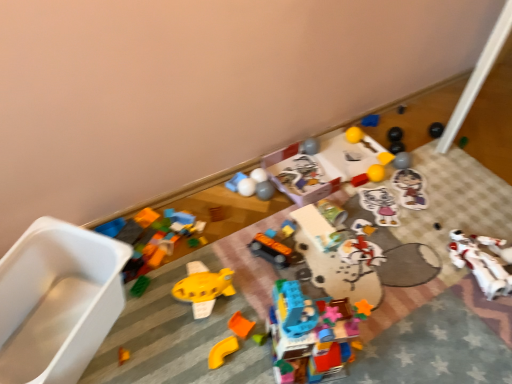
Where is `vacant area that lies between yellow rubber ball at upper center, the 3th toy in the right-to-left sequence, and orange matte plastic toy at lower center, the fifteenth toy viewed from the right`? vacant area that lies between yellow rubber ball at upper center, the 3th toy in the right-to-left sequence, and orange matte plastic toy at lower center, the fifteenth toy viewed from the right is located at coordinates (318, 236).